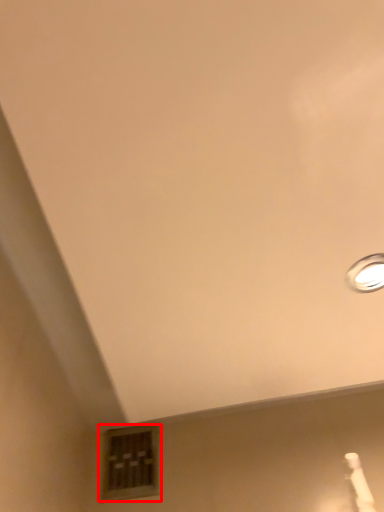
Question: In this image, where is window (annotated by the red box) located relative to lamp?

Choices:
 (A) left
 (B) right

Answer: (A)